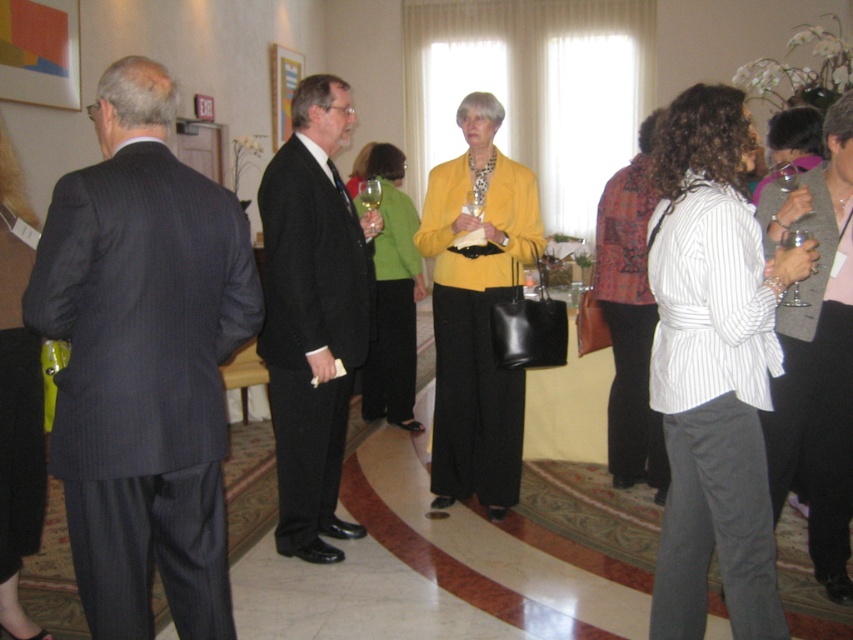
You are standing in the room and want to approach the patchwork jacket at center. Which direction should you move to get closer to it from the dark pinstripe suit at left?

Since the dark pinstripe suit at left is closer to the viewer than the patchwork jacket at center, you should move forward towards the center of the room to get closer to the patchwork jacket at center.

You are standing in the room and want to move from one point to another. If you start at point (395, 208) and walk towards point (747, 483), will you be moving towards or away from the large windows?

Point (747, 483) is closer to the viewer than point (395, 208). Since you are moving from point (395, 208) to point (747, 483), you are moving closer to the viewer. The large windows are behind you, so you are moving away from them.